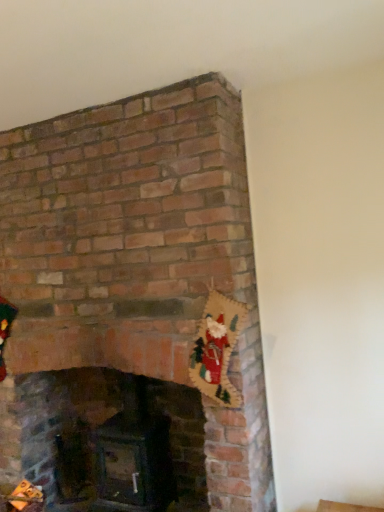
Describe the element at coordinates (109, 439) in the screenshot. This screenshot has height=512, width=384. I see `dark green wood stove at center` at that location.

Find the location of a particular element. The height and width of the screenshot is (512, 384). dark green wood stove at center is located at coordinates (109, 439).

What is the approximate width of dark green wood stove at center?

dark green wood stove at center is 39.13 centimeters wide.

Where is `dark green wood stove at center`? Image resolution: width=384 pixels, height=512 pixels. dark green wood stove at center is located at coordinates (109, 439).